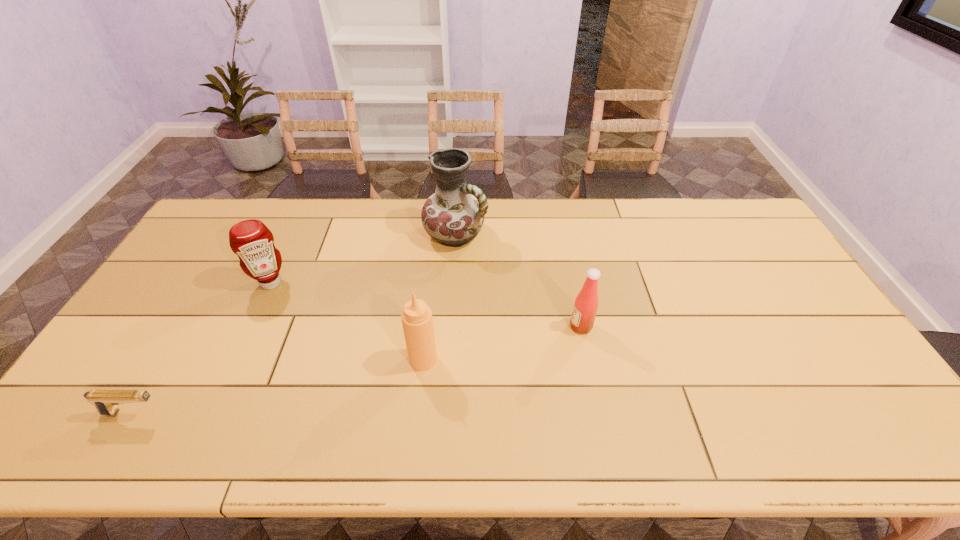
You are a GUI agent. You are given a task and a screenshot of the screen. Output one action in this format:
    pyautogui.click(x=<x>, y=<y>)
    Task: Click on the farthest object
    
    Given the screenshot: What is the action you would take?
    pyautogui.click(x=454, y=215)

At what (x,y) coordinates should I click in order to perform the action: click on vase. Please return your answer as a coordinate pair (x, y). Looking at the image, I should click on click(x=454, y=215).

Where is `the nearest condiment`? This screenshot has height=540, width=960. the nearest condiment is located at coordinates (417, 321).

Identify the location of the second condiment from left to right. Image resolution: width=960 pixels, height=540 pixels. (417, 321).

I want to click on the second farthest object, so click(x=251, y=240).

Locate an element on the screen. the farthest condiment is located at coordinates (251, 240).

At what (x,y) coordinates should I click in order to perform the action: click on the second farthest condiment. Please return your answer as a coordinate pair (x, y). Image resolution: width=960 pixels, height=540 pixels. Looking at the image, I should click on (585, 306).

Image resolution: width=960 pixels, height=540 pixels. I want to click on the third nearest object, so click(x=585, y=306).

Locate an element on the screen. This screenshot has width=960, height=540. pistol is located at coordinates (106, 401).

The height and width of the screenshot is (540, 960). I want to click on the leftmost object, so click(x=106, y=401).